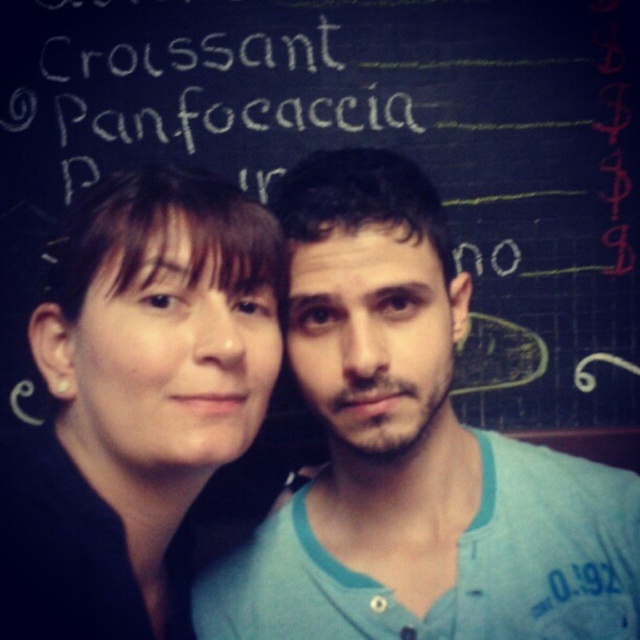
Question: In this image, where is black chalkboard at upper center located relative to blue cotton shirt at center?

Choices:
 (A) below
 (B) above

Answer: (B)

Question: Which of the following is the closest to the observer?

Choices:
 (A) blue cotton shirt at center
 (B) white chalk writing at upper center

Answer: (A)

Question: Which point is farther to the camera?

Choices:
 (A) (212, 346)
 (B) (148, 20)
 (C) (412, 636)
 (D) (8, 128)

Answer: (D)

Question: Can you confirm if black chalkboard at upper center is positioned to the left of matte black hair at upper left?

Choices:
 (A) no
 (B) yes

Answer: (A)

Question: Among these points, which one is nearest to the camera?

Choices:
 (A) (582, 573)
 (B) (195, 419)
 (C) (637, 429)
 (D) (220, 54)

Answer: (B)

Question: Can you confirm if black chalkboard at upper center is positioned to the left of white chalk writing at upper center?

Choices:
 (A) yes
 (B) no

Answer: (B)